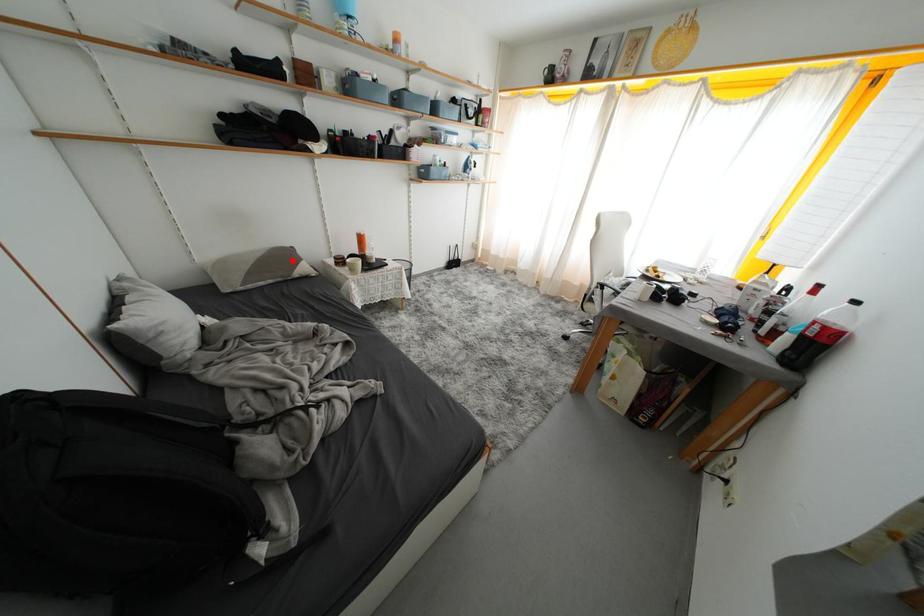
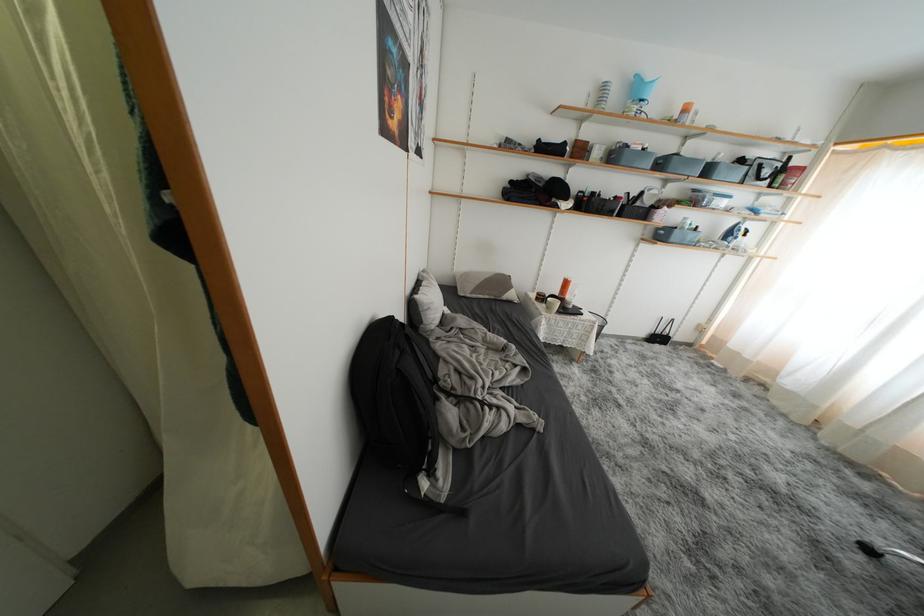
The point at the highlighted location is marked in the first image. Where is the corresponding point in the second image?

(508, 286)